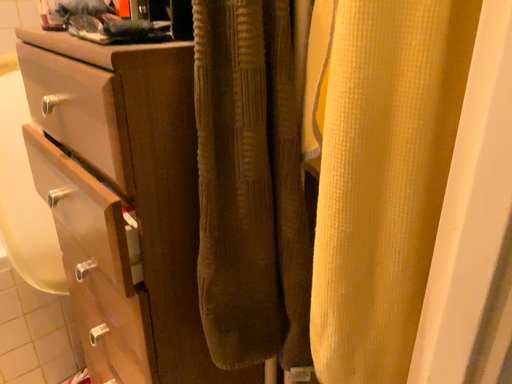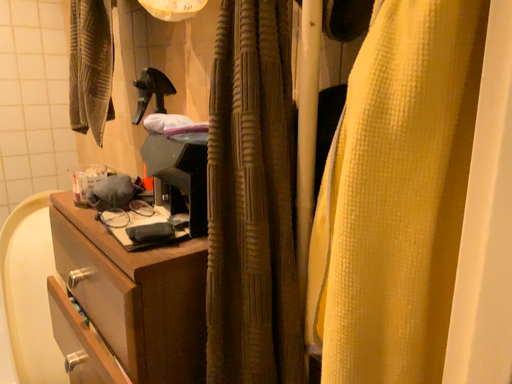
Question: Which way did the camera rotate in the video?

Choices:
 (A) rotated upward
 (B) rotated downward

Answer: (A)